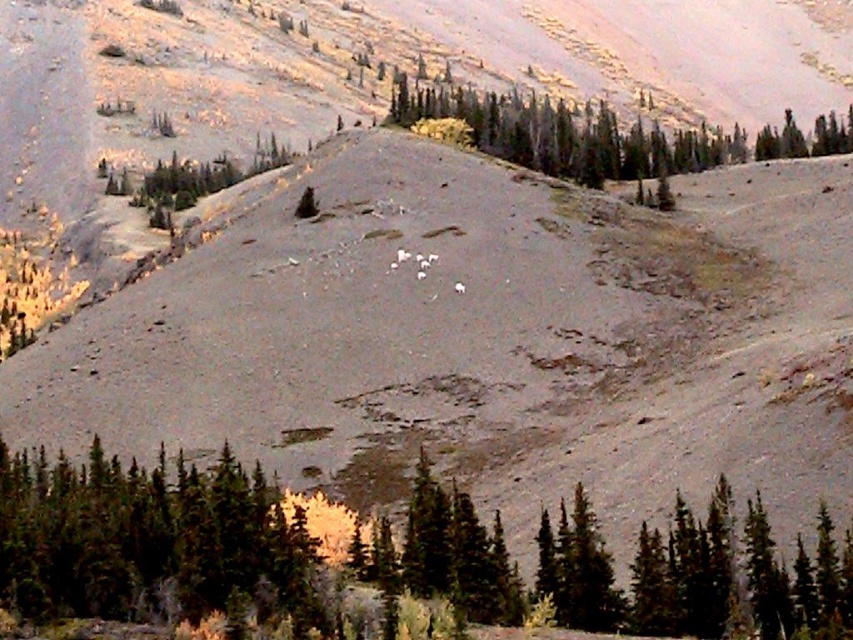
Is point (732, 620) closer to camera compared to point (593, 188)?

Yes, it is in front of point (593, 188).

Measure the distance between point (100, 564) and camera.

They are 231.99 feet apart.

Is point (265, 490) closer to viewer compared to point (432, 93)?

Yes, it is.

I want to click on green matte tree at center, so click(x=160, y=545).